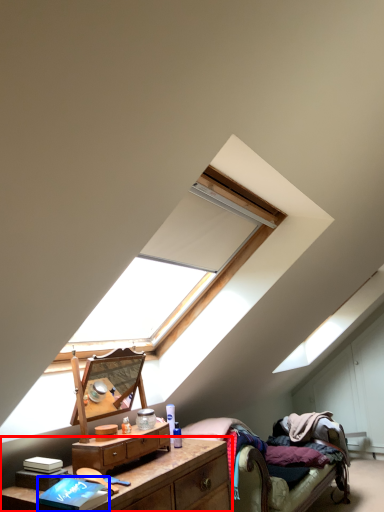
Question: Among these objects, which one is nearest to the camera, nightstand (highlighted by a red box) or book (highlighted by a blue box)?

Choices:
 (A) nightstand
 (B) book

Answer: (A)